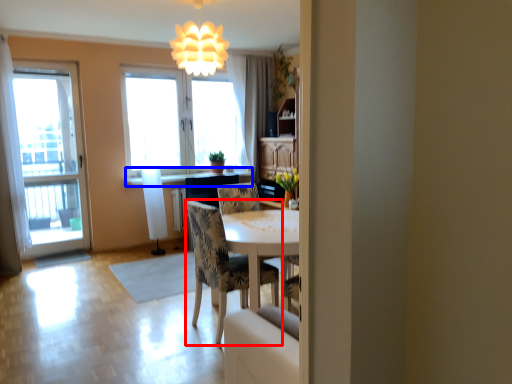
Question: Which of the following is the farthest to the observer, chair (highlighted by a red box) or counter top (highlighted by a blue box)?

Choices:
 (A) chair
 (B) counter top

Answer: (B)